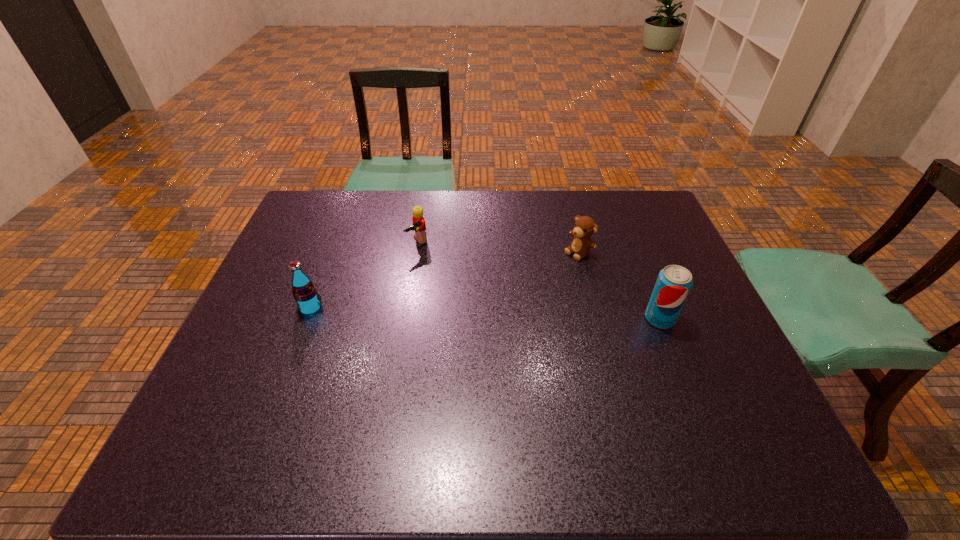
I want to click on free space between the Lego and the leftmost object, so click(364, 275).

You are a GUI agent. You are given a task and a screenshot of the screen. Output one action in this format:
    pyautogui.click(x=<x>, y=<y>)
    Task: Click on the free space that is in between the leftmost object and the third object from left to right
    The width and height of the screenshot is (960, 540).
    Given the screenshot: What is the action you would take?
    pyautogui.click(x=444, y=280)

Choose which object is the nearest neighbor to the teddy bear. Please provide its 2D coordinates. Your answer should be formatted as a tuple, i.e. [(x, y)], where the tuple contains the x and y coordinates of a point satisfying the conditions above.

[(674, 282)]

Identify the location of the closest object to the Lego. (304, 291).

At what (x,y) coordinates should I click in order to perform the action: click on vacant region that satisfies the following two spatial constraints: 1. on the front side of the teddy bear; 2. on the left side of the Lego. Please return your answer as a coordinate pair (x, y). Looking at the image, I should click on (417, 252).

This screenshot has width=960, height=540. Identify the location of vacant position in the image that satisfies the following two spatial constraints: 1. on the back side of the teddy bear; 2. on the right side of the left soda can. click(x=332, y=252).